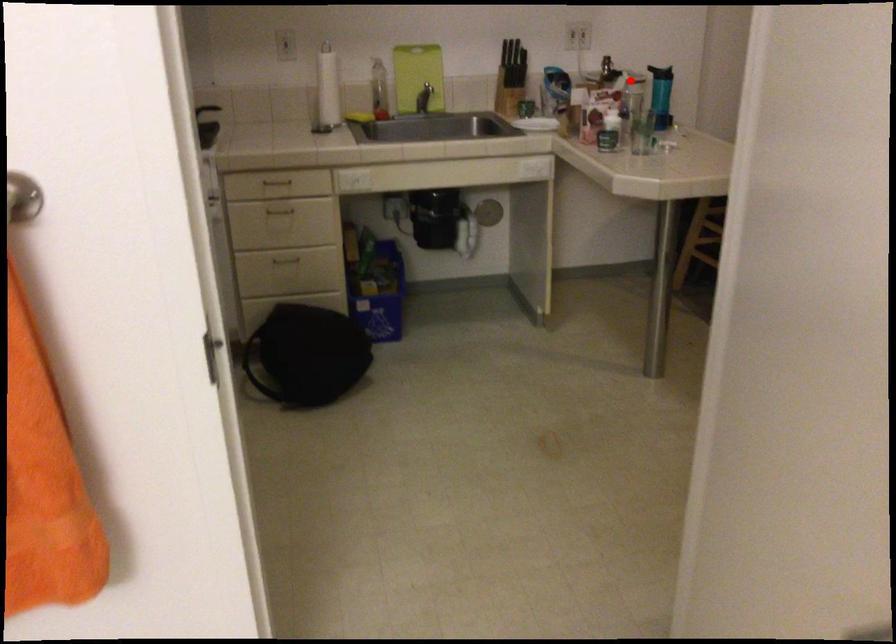
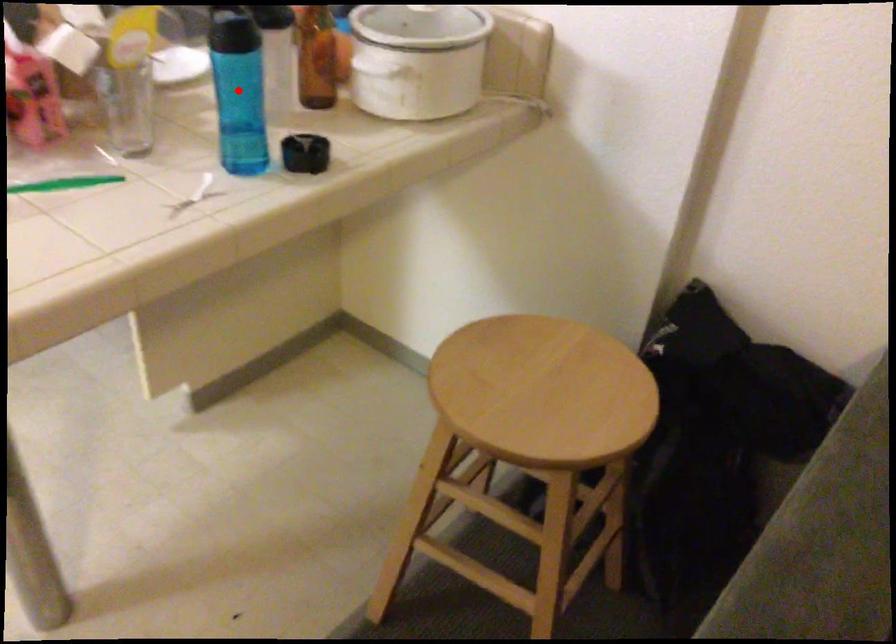
I am providing you with two images of the same scene from different viewpoints. A red point is marked on the first image and another point is marked on the second image. Do the highlighted points in image1 and image2 indicate the same real-world spot?

No